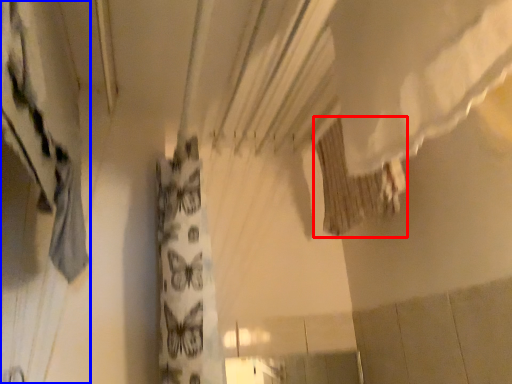
Question: Which object appears closest to the camera in this image, shower curtain (highlighted by a red box) or curtain (highlighted by a blue box)?

Choices:
 (A) shower curtain
 (B) curtain

Answer: (B)